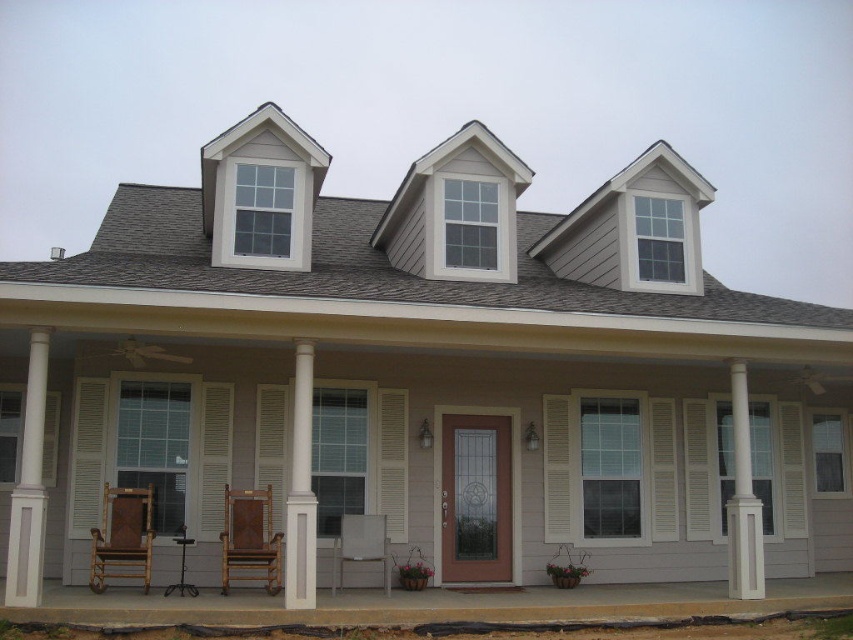
Question: Which point is closer to the camera taking this photo?

Choices:
 (A) (248, 577)
 (B) (137, 541)
 (C) (293, 588)
 (D) (57, 608)

Answer: (D)

Question: Is the position of white louvered shutter at center more distant than that of wooden rocking chair at lower left?

Choices:
 (A) no
 (B) yes

Answer: (B)

Question: Estimate the real-world distances between objects in this image. Which object is farther from the white smooth column at left?

Choices:
 (A) white painted wood column at right
 (B) white louvered shutter at center

Answer: (A)

Question: Which object is farther from the camera taking this photo?

Choices:
 (A) white painted wood column at right
 (B) light brown wooden chair at center
 (C) smooth concrete porch at center

Answer: (B)

Question: Can you confirm if white wood shutter at left is positioned to the left of white louvered shutter at center?

Choices:
 (A) no
 (B) yes

Answer: (B)

Question: Can you confirm if white wood shutter at left is positioned above light brown wooden chair at center?

Choices:
 (A) no
 (B) yes

Answer: (B)